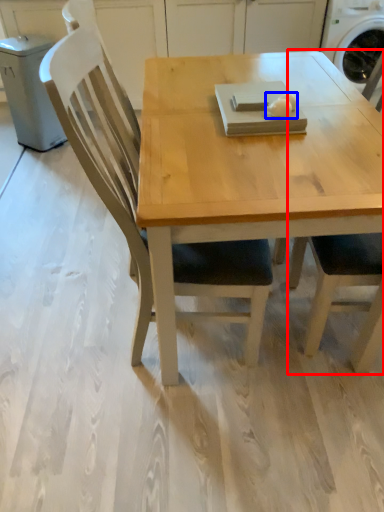
Question: Which point is closer to the camera, chair (highlighted by a red box) or food (highlighted by a blue box)?

Choices:
 (A) chair
 (B) food

Answer: (A)